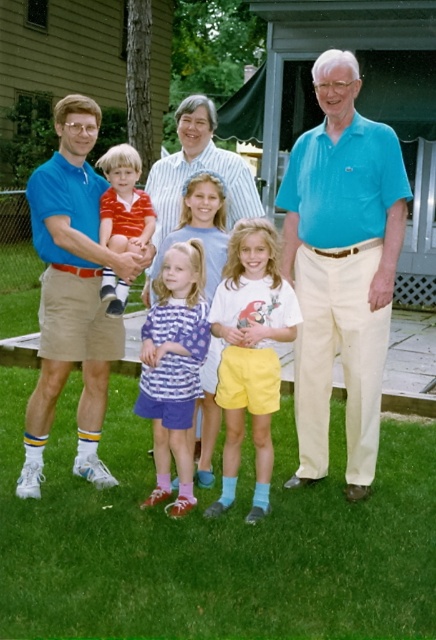
Does yellow cotton shorts at center appear on the right side of striped cotton shirt at center?

Correct, you'll find yellow cotton shorts at center to the right of striped cotton shirt at center.

Is yellow cotton shorts at center smaller than striped cotton shirt at center?

No.

The image size is (436, 640). What do you see at coordinates (251, 353) in the screenshot?
I see `yellow cotton shorts at center` at bounding box center [251, 353].

Where is `yellow cotton shorts at center`? The height and width of the screenshot is (640, 436). yellow cotton shorts at center is located at coordinates (251, 353).

Identify the location of striped cotton shirt at center. (173, 368).

Consider the image. Can you confirm if striped cotton shirt at center is taller than striped cotton shirt at left?

Yes, striped cotton shirt at center is taller than striped cotton shirt at left.

Is point (197, 268) positioned after point (149, 198)?

No.

Find the location of a particular element. The width and height of the screenshot is (436, 640). striped cotton shirt at center is located at coordinates (173, 368).

How far apart are blue cotton polo shirt at left and yellow cotton shorts at center?

blue cotton polo shirt at left and yellow cotton shorts at center are 38.82 inches apart from each other.

Does blue cotton polo shirt at left have a lesser height compared to yellow cotton shorts at center?

Incorrect, blue cotton polo shirt at left's height does not fall short of yellow cotton shorts at center's.

I want to click on blue cotton polo shirt at left, so click(x=72, y=292).

Where is `blue cotton polo shirt at left`? blue cotton polo shirt at left is located at coordinates (72, 292).